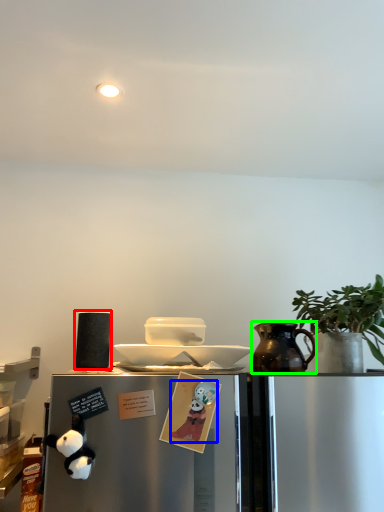
Question: Based on their relative distances, which object is nearer to appliance (highlighted by a red box)? Choose from toy (highlighted by a blue box) and jug (highlighted by a green box).

Choices:
 (A) toy
 (B) jug

Answer: (A)